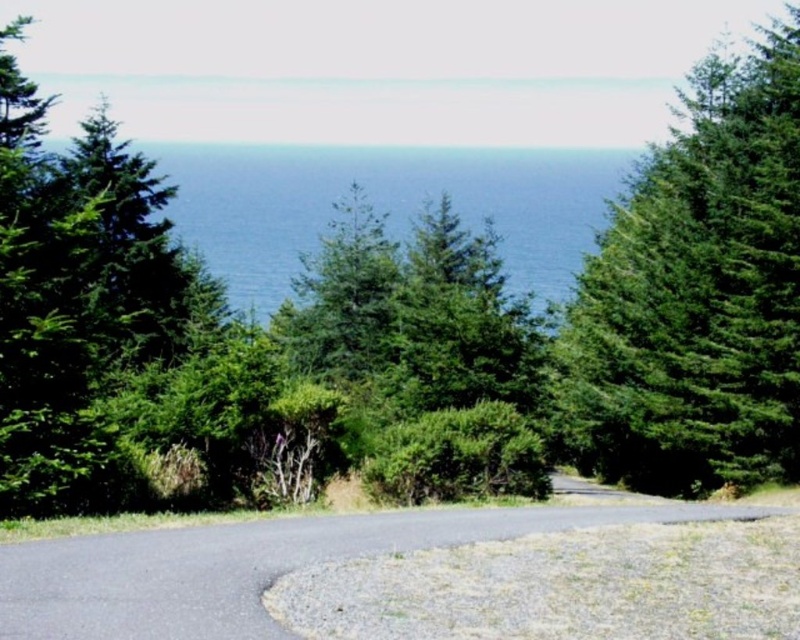
You are a hiker standing on the paved road in the coastal landscape. You notice the green textured tree at upper right and the blue water at center. Which object appears bigger in the image?

The green textured tree at upper right appears larger in size than the blue water at center according to the description.

You are a hiker standing on the road and want to reach the blue water at center. Which direction should you walk to avoid the green textured tree at upper right?

To reach the blue water at center while avoiding the green textured tree at upper right, you should walk to the left since the tree is positioned to the right of the water.

You are standing on the paved road in the coastal landscape. You see the green textured tree at upper right and the blue water at center. Which object is farther away from you?

The green textured tree at upper right is 256.49 feet away from the blue water at center. Since the question asks which is farther from you, we need to consider your position on the road. If you are on the road between them, the tree might be closer or farther depending on where you stand. However, without exact positioning, it is impossible to determine which is farther away based solely on the given distance between the two objects.